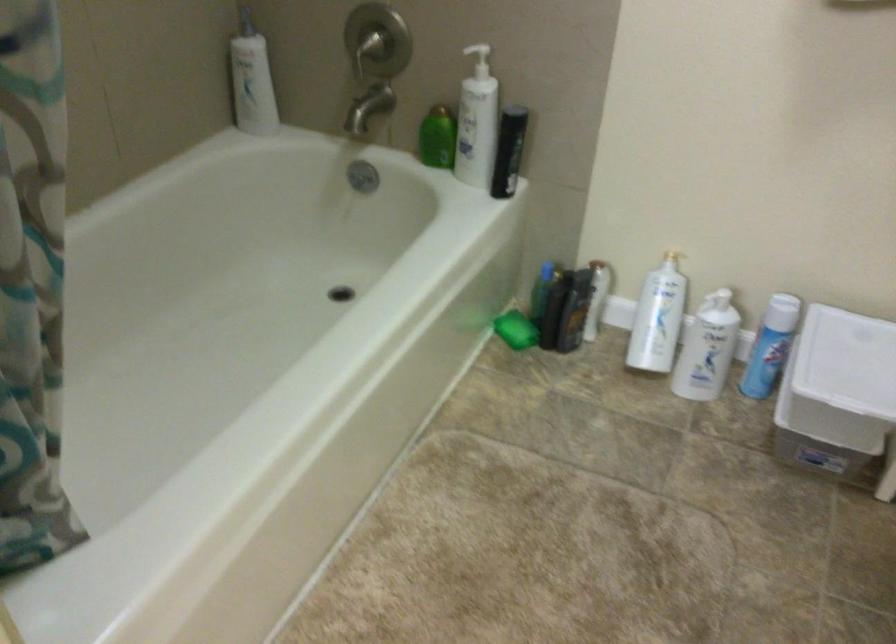
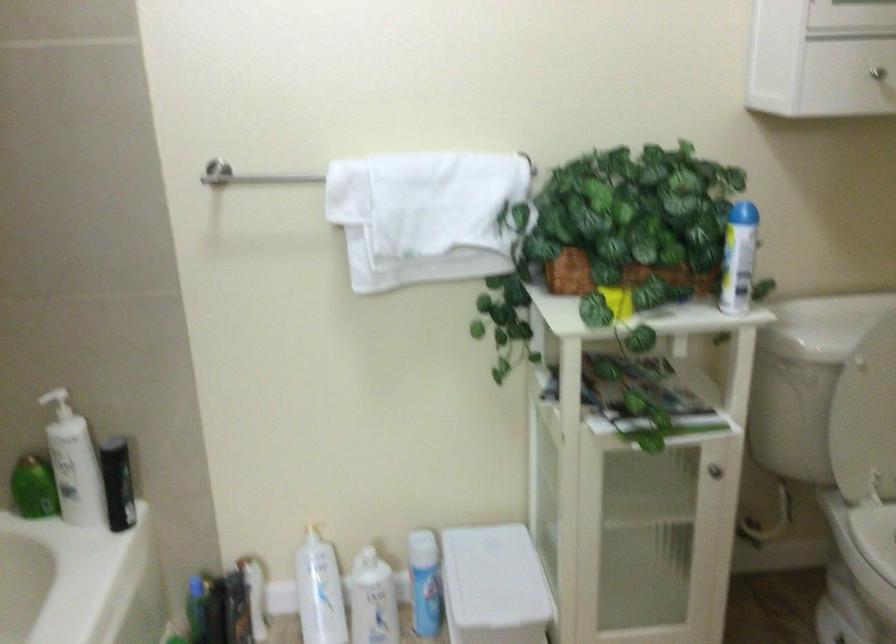
Find the pixel in the second image that matches point 657,317 in the first image.

(319, 591)